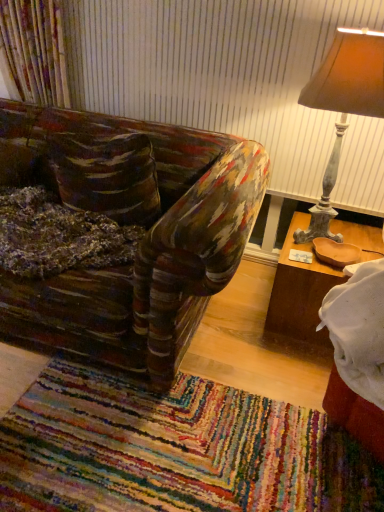
Question: Is wooden tray at right surrounding matte brown lampshade at upper right?

Choices:
 (A) no
 (B) yes

Answer: (A)

Question: From a real-world perspective, is wooden tray at right on top of matte brown lampshade at upper right?

Choices:
 (A) no
 (B) yes

Answer: (A)

Question: Are wooden tray at right and matte brown lampshade at upper right far apart?

Choices:
 (A) no
 (B) yes

Answer: (A)

Question: Considering the relative sizes of wooden tray at right and matte brown lampshade at upper right in the image provided, is wooden tray at right wider than matte brown lampshade at upper right?

Choices:
 (A) no
 (B) yes

Answer: (B)

Question: Does wooden tray at right come behind matte brown lampshade at upper right?

Choices:
 (A) no
 (B) yes

Answer: (B)

Question: From the image's perspective, is wooden tray at right beneath matte brown lampshade at upper right?

Choices:
 (A) no
 (B) yes

Answer: (B)

Question: From the image's perspective, is matte brown lampshade at upper right below wooden tray at right?

Choices:
 (A) no
 (B) yes

Answer: (A)

Question: Is wooden tray at right a part of matte brown lampshade at upper right?

Choices:
 (A) no
 (B) yes

Answer: (A)

Question: Is matte brown lampshade at upper right in front of wooden tray at right?

Choices:
 (A) no
 (B) yes

Answer: (B)

Question: Can you confirm if matte brown lampshade at upper right is bigger than wooden tray at right?

Choices:
 (A) yes
 (B) no

Answer: (A)

Question: Can you confirm if matte brown lampshade at upper right is positioned to the right of wooden tray at right?

Choices:
 (A) no
 (B) yes

Answer: (A)

Question: Is matte brown lampshade at upper right to the left of wooden tray at right from the viewer's perspective?

Choices:
 (A) no
 (B) yes

Answer: (B)

Question: From the image's perspective, is wooden tray at right positioned above or below matte brown lampshade at upper right?

Choices:
 (A) below
 (B) above

Answer: (A)